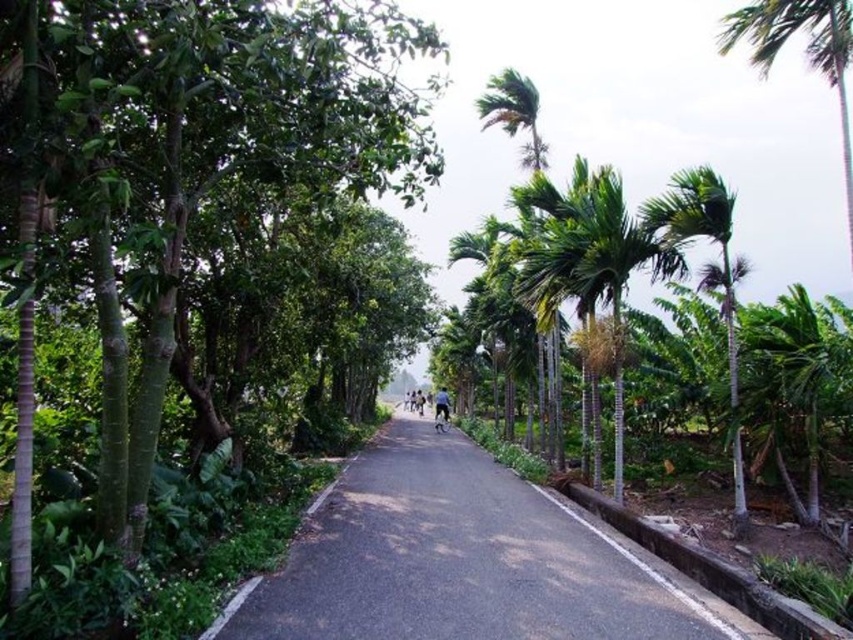
Question: Estimate the real-world distances between objects in this image. Which object is closer to the green leafy tree at center?

Choices:
 (A) black asphalt road at center
 (B) green leafy palm tree at upper right

Answer: (A)

Question: Is black asphalt road at center in front of green leafy palm tree at upper right?

Choices:
 (A) no
 (B) yes

Answer: (B)

Question: Which object is farther from the camera taking this photo?

Choices:
 (A) black asphalt road at center
 (B) green leafy tree at center

Answer: (A)

Question: Can you confirm if black asphalt road at center is bigger than green leafy palm tree at upper right?

Choices:
 (A) no
 (B) yes

Answer: (A)

Question: Is green leafy tree at center wider than green leafy palm tree at upper right?

Choices:
 (A) no
 (B) yes

Answer: (A)

Question: Which object is the farthest from the green leafy tree at center?

Choices:
 (A) black asphalt road at center
 (B) green leafy palm tree at upper right

Answer: (B)